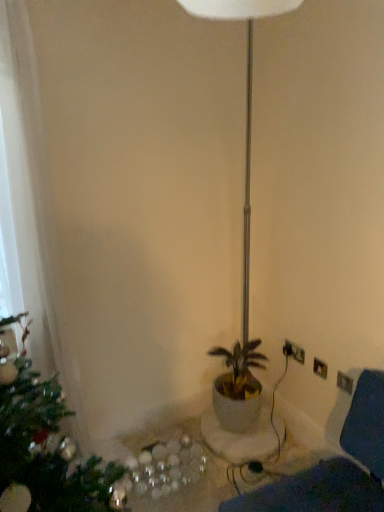
Describe the element at coordinates (334, 466) in the screenshot. I see `white fabric swivel chair at lower right` at that location.

What is the approximate height of white plastic electric outlet at lower right?

white plastic electric outlet at lower right is 8.59 centimeters in height.

At what (x,y) coordinates should I click in order to perform the action: click on white fabric swivel chair at lower right. Please return your answer as a coordinate pair (x, y). Looking at the image, I should click on (334, 466).

Would you say white glossy table at lower center is a long distance from white plastic electric outlet at lower right?

No, there isn't a large distance between white glossy table at lower center and white plastic electric outlet at lower right.

From a real-world perspective, is white glossy table at lower center above or below white plastic electric outlet at lower right?

white glossy table at lower center is situated lower than white plastic electric outlet at lower right in the real world.

Is white glossy table at lower center oriented away from white plastic electric outlet at lower right?

white glossy table at lower center does not have its back to white plastic electric outlet at lower right.

Considering the positions of objects white fabric swivel chair at lower right and white glossy table at lower center in the image provided, who is more to the right, white fabric swivel chair at lower right or white glossy table at lower center?

From the viewer's perspective, white fabric swivel chair at lower right appears more on the right side.

Can you confirm if white fabric swivel chair at lower right is wider than white glossy table at lower center?

No, white fabric swivel chair at lower right is not wider than white glossy table at lower center.

Consider the image. From the image's perspective, is white fabric swivel chair at lower right under white glossy table at lower center?

Incorrect, from the image's perspective, white fabric swivel chair at lower right is higher than white glossy table at lower center.

From the picture: From a real-world perspective, relative to white plastic electric outlet at lower right, is white fabric swivel chair at lower right vertically above or below?

From a real-world perspective, white fabric swivel chair at lower right is physically below white plastic electric outlet at lower right.

Is white fabric swivel chair at lower right wider or thinner than white plastic electric outlet at lower right?

white fabric swivel chair at lower right is wider than white plastic electric outlet at lower right.

Does white fabric swivel chair at lower right touch white plastic electric outlet at lower right?

white fabric swivel chair at lower right is not next to white plastic electric outlet at lower right, and they're not touching.

Who is bigger, white fabric swivel chair at lower right or white plastic electric outlet at lower right?

white fabric swivel chair at lower right.

Is white plastic electric outlet at lower right next to white fabric swivel chair at lower right and touching it?

white plastic electric outlet at lower right and white fabric swivel chair at lower right are clearly separated.

From the picture: What's the angular difference between white plastic electric outlet at lower right and white fabric swivel chair at lower right's facing directions?

The angular difference between white plastic electric outlet at lower right and white fabric swivel chair at lower right is 4.13 degrees.

The width and height of the screenshot is (384, 512). In order to click on electric outlet on the right of white fabric swivel chair at lower right in this screenshot , I will do `click(294, 352)`.

Considering the relative sizes of white plastic electric outlet at lower right and white fabric swivel chair at lower right in the image provided, is white plastic electric outlet at lower right wider than white fabric swivel chair at lower right?

No, white plastic electric outlet at lower right is not wider than white fabric swivel chair at lower right.

From the image's perspective, is white plastic electric outlet at lower right on white glossy table at lower center?

Yes, from the image's perspective, white plastic electric outlet at lower right is on top of white glossy table at lower center.

Is white plastic electric outlet at lower right aimed at white glossy table at lower center?

No, white plastic electric outlet at lower right is not aimed at white glossy table at lower center.

I want to click on table lying in front of the white plastic electric outlet at lower right, so click(x=172, y=438).

From the picture: How different are the orientations of white plastic electric outlet at lower right and white glossy table at lower center in degrees?

There is a 3.56-degree angle between the facing directions of white plastic electric outlet at lower right and white glossy table at lower center.

Between white glossy table at lower center and white fabric swivel chair at lower right, which one has larger width?

white glossy table at lower center is wider.

Can you confirm if white glossy table at lower center is shorter than white fabric swivel chair at lower right?

Yes, white glossy table at lower center is shorter than white fabric swivel chair at lower right.

Is white glossy table at lower center further to the viewer compared to white fabric swivel chair at lower right?

Yes, it is behind white fabric swivel chair at lower right.

Image resolution: width=384 pixels, height=512 pixels. I want to click on table below the white plastic electric outlet at lower right (from the image's perspective), so click(x=172, y=438).

The height and width of the screenshot is (512, 384). In order to click on table below the white fabric swivel chair at lower right (from a real-world perspective) in this screenshot , I will do `click(172, 438)`.

Based on their spatial positions, is white fabric swivel chair at lower right or white plastic electric outlet at lower right further from white glossy table at lower center?

white fabric swivel chair at lower right is positioned further to the anchor white glossy table at lower center.

Which object lies further to the anchor point white plastic electric outlet at lower right, white glossy table at lower center or white fabric swivel chair at lower right?

The object further to white plastic electric outlet at lower right is white fabric swivel chair at lower right.

Estimate the real-world distances between objects in this image. Which object is closer to white glossy table at lower center, white plastic electric outlet at lower right or white fabric swivel chair at lower right?

white plastic electric outlet at lower right lies closer to white glossy table at lower center than the other object.

Based on their spatial positions, is white fabric swivel chair at lower right or white glossy table at lower center closer to white plastic electric outlet at lower right?

white glossy table at lower center lies closer to white plastic electric outlet at lower right than the other object.

Which object lies nearer to the anchor point white fabric swivel chair at lower right, white plastic electric outlet at lower right or white glossy table at lower center?

white glossy table at lower center is positioned closer to the anchor white fabric swivel chair at lower right.

Which object lies further to the anchor point white fabric swivel chair at lower right, white glossy table at lower center or white plastic electric outlet at lower right?

Based on the image, white plastic electric outlet at lower right appears to be further to white fabric swivel chair at lower right.

You are a GUI agent. You are given a task and a screenshot of the screen. Output one action in this format:
    pyautogui.click(x=<x>, y=<y>)
    Task: Click on the table between white fabric swivel chair at lower right and white plastic electric outlet at lower right along the z-axis
    The width and height of the screenshot is (384, 512).
    Given the screenshot: What is the action you would take?
    pyautogui.click(x=172, y=438)